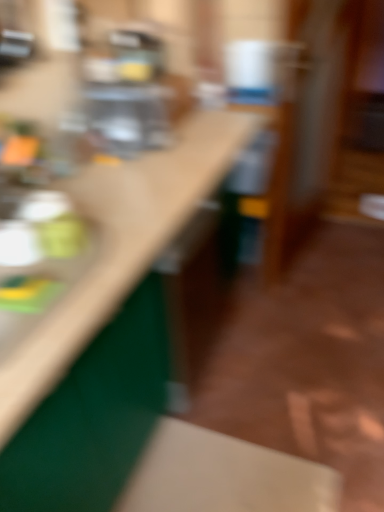
Find the location of `free spot in front of wooden at left`. free spot in front of wooden at left is located at coordinates pos(196,456).